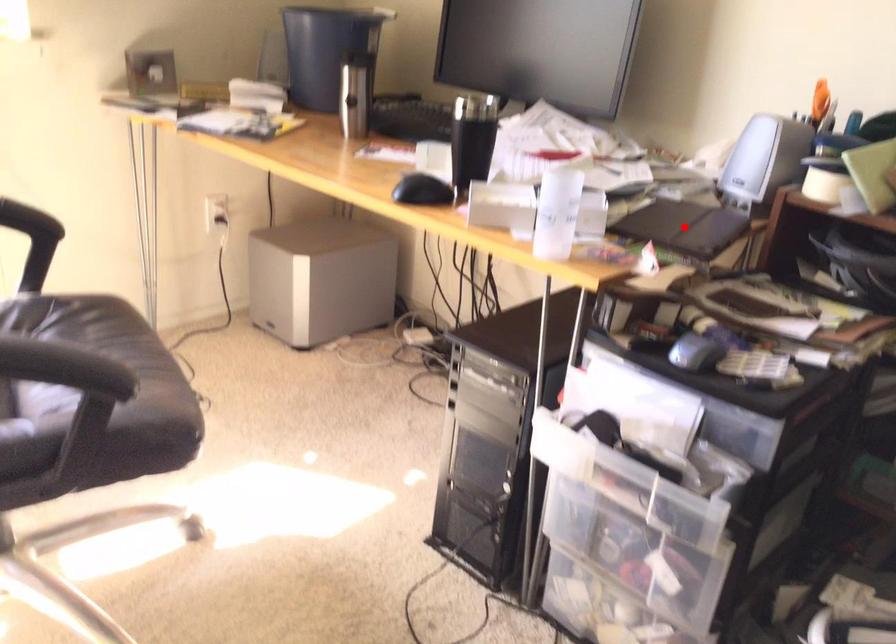
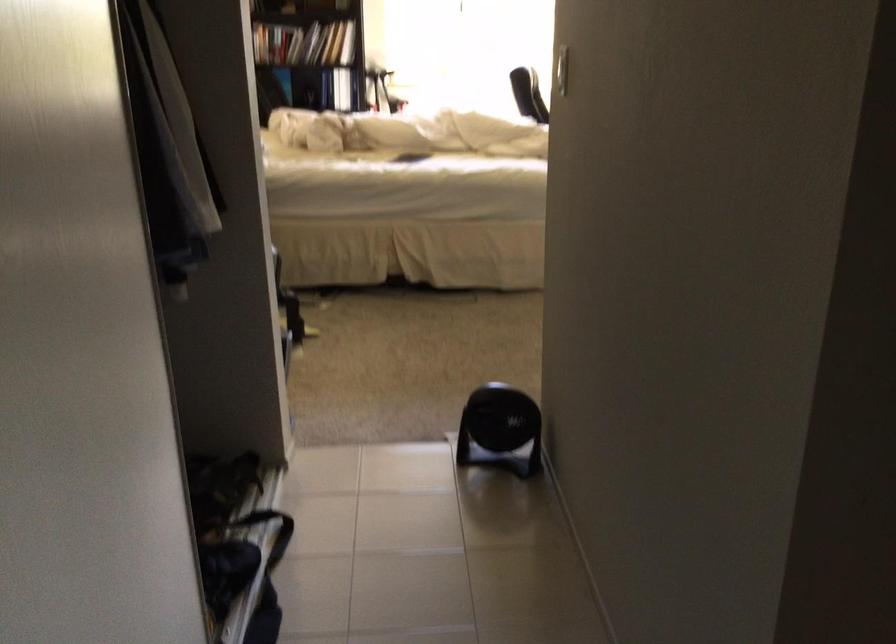
Question: I am providing you with two images of the same scene from different viewpoints. A red point is marked on the first image. At the location where the point appears in image 1, is it still visible in image 2?

Choices:
 (A) Yes
 (B) No

Answer: (B)